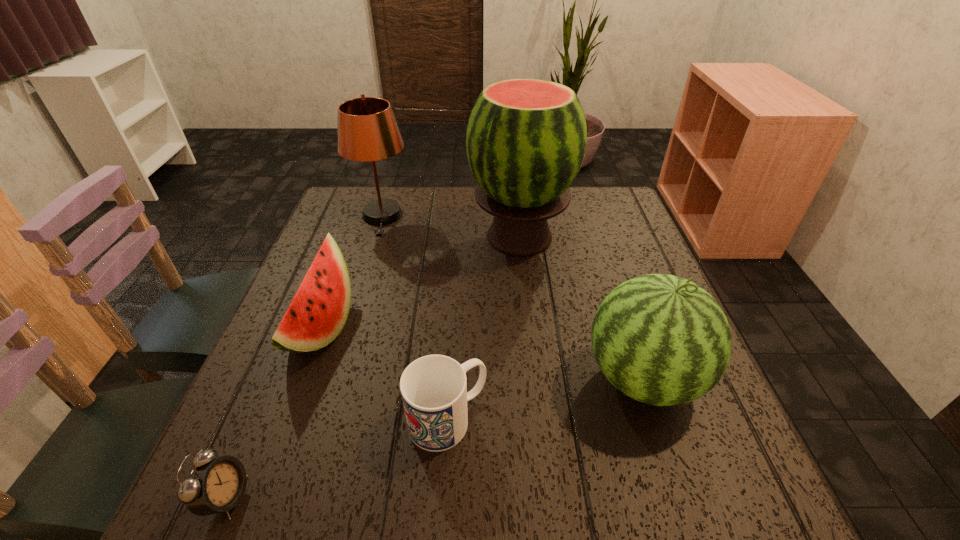
Image resolution: width=960 pixels, height=540 pixels. Find the location of `vacant space located on the back of the second shortest watermelon`. vacant space located on the back of the second shortest watermelon is located at coordinates (612, 287).

Where is `vacant space positioned 0.250m on the outer rind of the shortest watermelon`? vacant space positioned 0.250m on the outer rind of the shortest watermelon is located at coordinates (462, 328).

Where is `free spot located 0.110m on the front of the mug`? This screenshot has width=960, height=540. free spot located 0.110m on the front of the mug is located at coordinates (442, 522).

At what (x,y) coordinates should I click in order to perform the action: click on vacant space located 0.330m on the face of the shortest object. Please return your answer as a coordinate pair (x, y). The width and height of the screenshot is (960, 540). Looking at the image, I should click on (458, 497).

You are a GUI agent. You are given a task and a screenshot of the screen. Output one action in this format:
    pyautogui.click(x=<x>, y=<y>)
    Task: Click on the watermelon that is at the far edge
    
    Given the screenshot: What is the action you would take?
    pyautogui.click(x=526, y=139)

Locate an element on the screen. The width and height of the screenshot is (960, 540). lampshade located in the far edge section of the desktop is located at coordinates (367, 130).

Find the location of a particular element. object that is at the near edge is located at coordinates (214, 485).

Find the location of a particular element. lampshade that is at the left edge is located at coordinates (367, 130).

Where is `watermelon present at the left edge`? watermelon present at the left edge is located at coordinates (318, 312).

Locate an element on the screen. alarm clock present at the left edge is located at coordinates (214, 485).